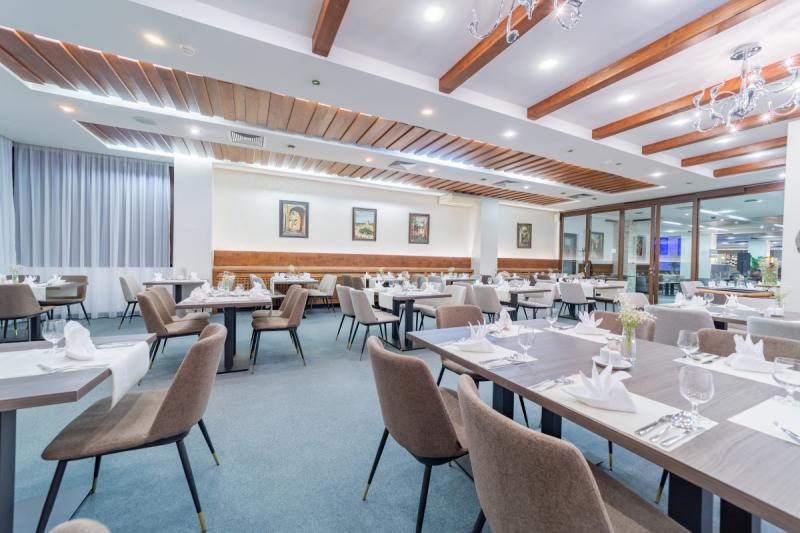
Locate an element on the screen. This screenshot has height=533, width=800. water glasses on tables in foreground is located at coordinates click(x=689, y=386), click(x=786, y=375), click(x=682, y=345), click(x=546, y=313), click(x=520, y=341), click(x=58, y=329), click(x=706, y=298).